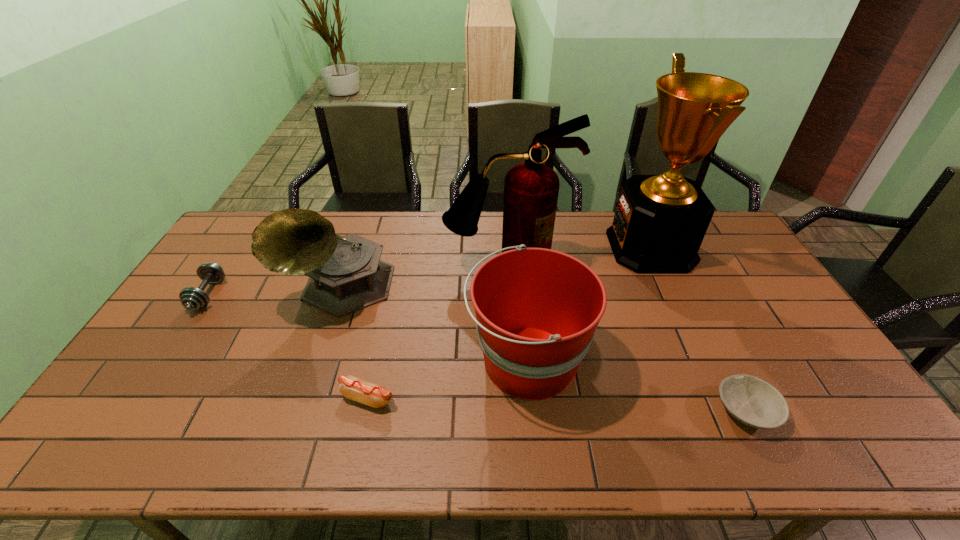
The image size is (960, 540). Find the location of `blank area in the image that satisfies the following two spatial constraints: 1. on the front of the trophy cup with the label; 2. on the front side of the third shortest object`. blank area in the image that satisfies the following two spatial constraints: 1. on the front of the trophy cup with the label; 2. on the front side of the third shortest object is located at coordinates (673, 295).